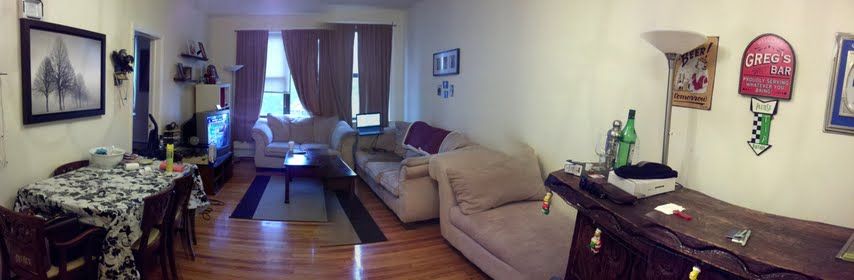
This screenshot has height=280, width=854. I want to click on curtains, so click(250, 56), click(299, 50), click(338, 48), click(376, 61).